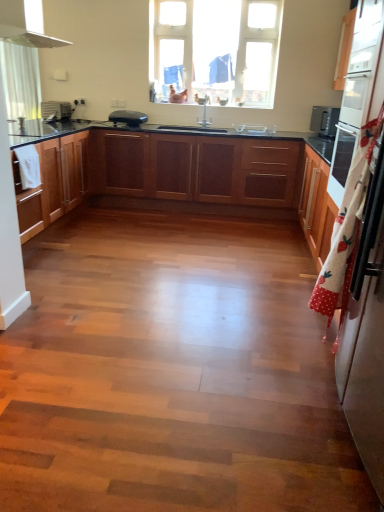
Question: Is black plastic toaster at upper center, the 2th appliance viewed from the left, bigger or smaller than white glossy sink at center?

Choices:
 (A) small
 (B) big

Answer: (B)

Question: Visually, is black plastic toaster at upper center, the 2th appliance viewed from the left, positioned to the left or to the right of white glossy sink at center?

Choices:
 (A) left
 (B) right

Answer: (A)

Question: Estimate the real-world distances between objects in this image. Which object is farther from the white glossy refrigerator at right?

Choices:
 (A) wooden cabinets at center, which ranks as the 1th cabinetry in front-to-back order
 (B) wooden cabinets at left, acting as the second cabinetry starting from the front
 (C) wooden cabinets at center, which is the 1th cabinetry from back to front
 (D) matte black toaster at left, marked as the 1th appliance in a left-to-right arrangement
 (E) black plastic toaster at upper center, which ranks as the first appliance in right-to-left order

Answer: (D)

Question: Considering the real-world distances, which object is farthest from the wooden cabinets at center, the 3th cabinetry from the back?

Choices:
 (A) white glossy oven at right
 (B) white polka dot fabric at right
 (C) transparent glass window at upper center
 (D) matte black toaster at left, which appears as the 2th appliance when viewed from the right
 (E) wooden cabinets at left, acting as the second cabinetry starting from the front

Answer: (B)